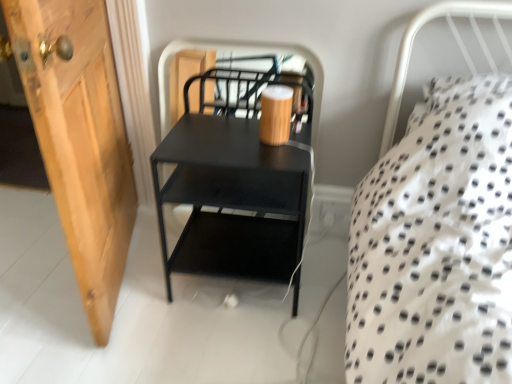
Image resolution: width=512 pixels, height=384 pixels. I want to click on free location in front of wooden door at left, so click(82, 327).